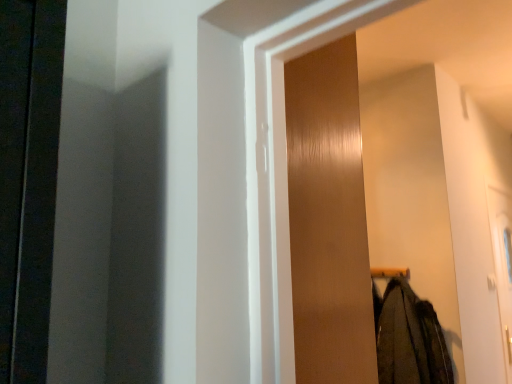
Question: Would you say wooden screen door at center is to the left or to the right of dark green wool coat at lower right in the picture?

Choices:
 (A) right
 (B) left

Answer: (B)

Question: From the image's perspective, is wooden screen door at center above or below dark green wool coat at lower right?

Choices:
 (A) above
 (B) below

Answer: (A)

Question: Is wooden screen door at center in front of or behind dark green wool coat at lower right in the image?

Choices:
 (A) behind
 (B) front

Answer: (B)

Question: Based on their sizes in the image, would you say dark green wool coat at lower right is bigger or smaller than wooden screen door at center?

Choices:
 (A) big
 (B) small

Answer: (B)

Question: From the image's perspective, is dark green wool coat at lower right above or below wooden screen door at center?

Choices:
 (A) below
 (B) above

Answer: (A)

Question: From a real-world perspective, is dark green wool coat at lower right physically located above or below wooden screen door at center?

Choices:
 (A) above
 (B) below

Answer: (B)

Question: Based on their positions, is dark green wool coat at lower right located to the left or right of wooden screen door at center?

Choices:
 (A) right
 (B) left

Answer: (A)